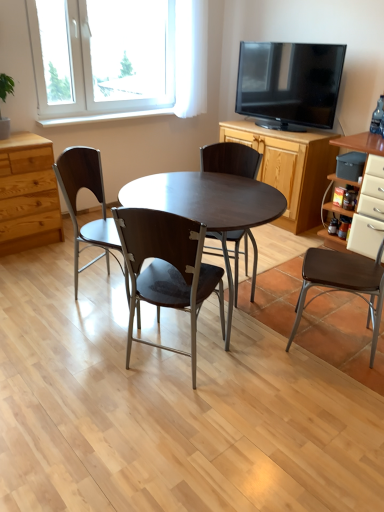
I want to click on unoccupied area in front of matte brown chair at left, acting as the 4th chair starting from the right, so click(x=83, y=332).